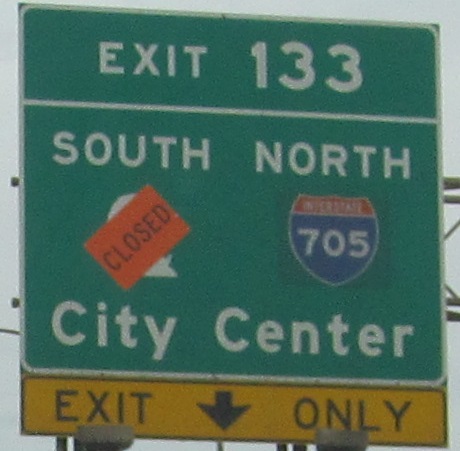
Image resolution: width=460 pixels, height=451 pixels. Find the location of `corners`. corners is located at coordinates (436, 24), (21, 2), (21, 432), (446, 446).